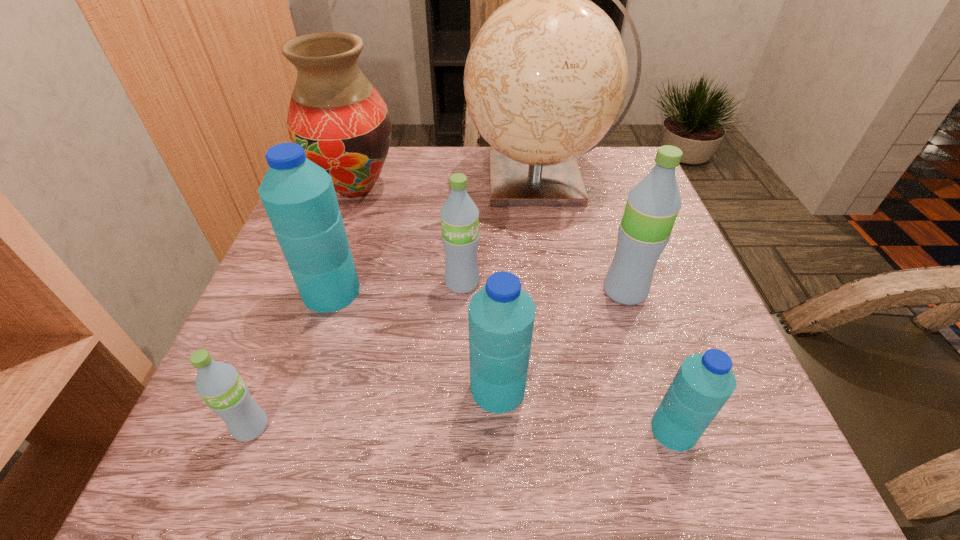
Image resolution: width=960 pixels, height=540 pixels. In order to click on the smallest green water bottle in this screenshot , I will do `click(219, 384)`.

You are a GUI agent. You are given a task and a screenshot of the screen. Output one action in this format:
    pyautogui.click(x=<x>, y=<y>)
    Task: Click on the vacant space located 0.120m on the surface of the tallest object showing Europe and Africa
    
    Given the screenshot: What is the action you would take?
    pyautogui.click(x=419, y=180)

The image size is (960, 540). What are the coordinates of `free space located on the surface of the tallest object showing Europe and Africa` in the screenshot? It's located at (426, 180).

In order to click on free point located on the surface of the tallest object showing Europe and Africa in this screenshot , I will do `click(372, 180)`.

You are a GUI agent. You are given a task and a screenshot of the screen. Output one action in this format:
    pyautogui.click(x=<x>, y=<y>)
    Task: Click on the vacant space located 0.350m on the right of the vase
    This screenshot has width=960, height=540.
    Given the screenshot: What is the action you would take?
    pyautogui.click(x=540, y=188)

I want to click on free space located 0.300m on the back of the rightmost green water bottle, so click(x=592, y=191).

Find the location of a particular element. This screenshot has width=960, height=540. free space located 0.300m on the right of the leftmost blue water bottle is located at coordinates (515, 292).

Find the location of a particular element. This screenshot has height=540, width=960. vacant space located on the back of the second smallest green water bottle is located at coordinates (464, 254).

Where is `blank space located on the back of the second biggest blue water bottle`? blank space located on the back of the second biggest blue water bottle is located at coordinates (494, 269).

Locate an element on the screen. This screenshot has height=540, width=960. vacant region located on the back of the rightmost blue water bottle is located at coordinates (658, 381).